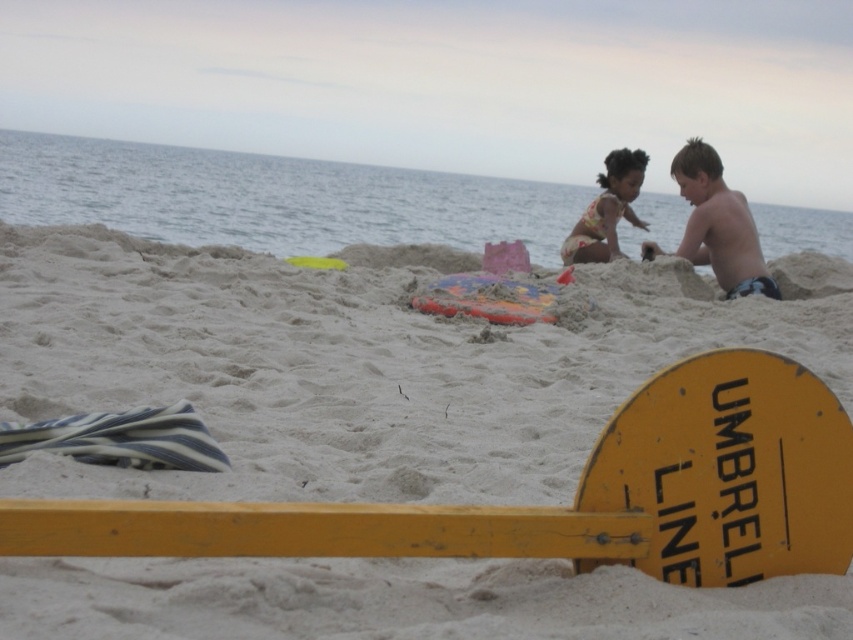
Based on the photo, you are a beachgoer who wants to place a small cooler on the beach. The cooler is 30 cm in height. You have two options to place it either on the white sand at center or light brown skin at upper right. Which location would allow the cooler to be more visible to someone approaching from the front?

The white sand at center is much taller than the light brown skin at upper right, so placing the cooler on the white sand at center would make it more visible since it has a higher elevation.

You are a beachgoer who wants to place your towel next to the white sand at center without covering the floral swimsuit at center. According to the scene description, where should you place your towel?

The white sand at center is positioned on the left side of the floral swimsuit at center, so you should place your towel to the right of the floral swimsuit at center to avoid covering it.

You are a photographer trying to capture a wide shot of the beach scene. You need to ensure that both the light brown skin at upper right and the floral swimsuit at center are fully visible in the frame. Given their sizes, which object should you focus on to ensure both are in the frame without cropping?

Since the light brown skin at upper right is wider than the floral swimsuit at center, you should focus on positioning the camera so that the larger light brown skin at upper right fits within the frame first. This will ensure there is enough space for the smaller floral swimsuit at center as well.